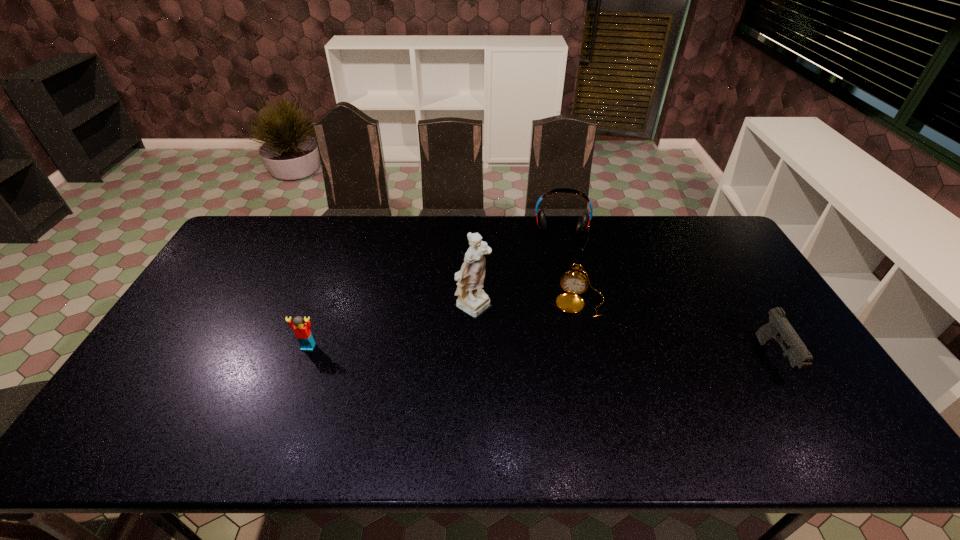
You are a GUI agent. You are given a task and a screenshot of the screen. Output one action in this format:
    pyautogui.click(x=<x>, y=<y>)
    Task: Click on the blank space located 0.270m on the front-facing side of the figurine
    This screenshot has height=540, width=960.
    Given the screenshot: What is the action you would take?
    pyautogui.click(x=575, y=357)

The width and height of the screenshot is (960, 540). In order to click on free space located on the front-facing side of the figurine in this screenshot , I will do `click(579, 359)`.

The width and height of the screenshot is (960, 540). I want to click on vacant region located with the microphone attached to the side of the headset, so click(562, 262).

Image resolution: width=960 pixels, height=540 pixels. Identify the location of vacant region located with the microphone attached to the side of the headset. (561, 268).

Find the location of a particular element. The image size is (960, 540). free space located 0.240m with the microphone attached to the side of the headset is located at coordinates (561, 301).

Find the location of a particular element. The image size is (960, 540). vacant space positioned 0.260m on the face of the pocket watch is located at coordinates (561, 389).

You are a GUI agent. You are given a task and a screenshot of the screen. Output one action in this format:
    pyautogui.click(x=<x>, y=<y>)
    Task: Click on the vacant space located on the face of the pocket watch
    Image resolution: width=960 pixels, height=540 pixels.
    Given the screenshot: What is the action you would take?
    pyautogui.click(x=563, y=382)

Find the location of a particular element. The image size is (960, 540). free space located 0.220m on the face of the pocket watch is located at coordinates (564, 376).

This screenshot has width=960, height=540. Identify the location of object located at the far edge. (583, 225).

The image size is (960, 540). Identify the location of object present at the near edge. (778, 328).